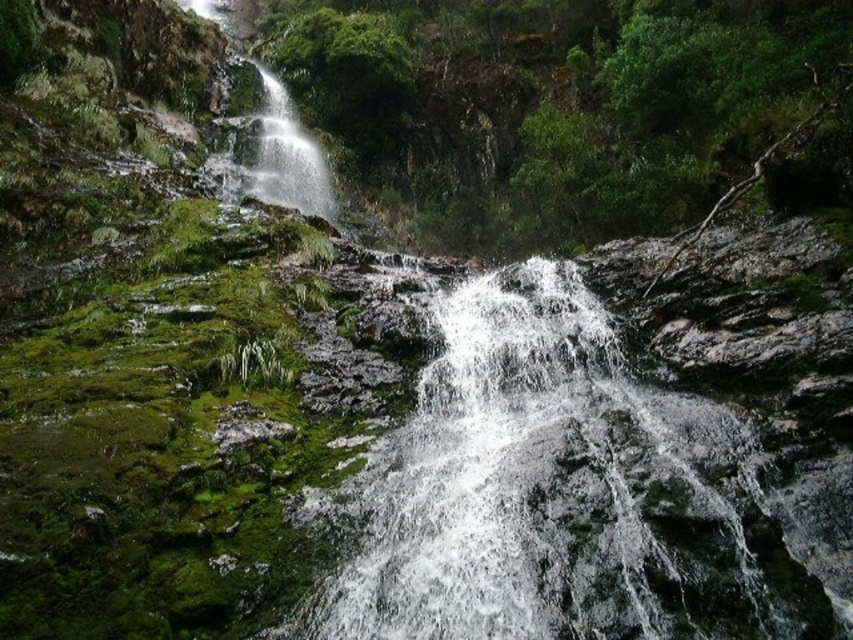
You are a hiker who wants to cross the waterfall area. You see the green mossy rock at upper center and the clear water at center. Which object should you avoid stepping on to prevent slipping?

You should avoid stepping on the green mossy rock at upper center because moss is slippery and it is positioned to the left of the clear water at center, making it a potential hazard.

You are a hiker trying to cross the waterfall area. You see the green mossy rock at upper center and the clear water at center. Which object would be a safer stepping stone for you to avoid slipping?

The green mossy rock at upper center is a safer stepping stone because it has a larger size compared to the clear water at center, providing more stable footing.